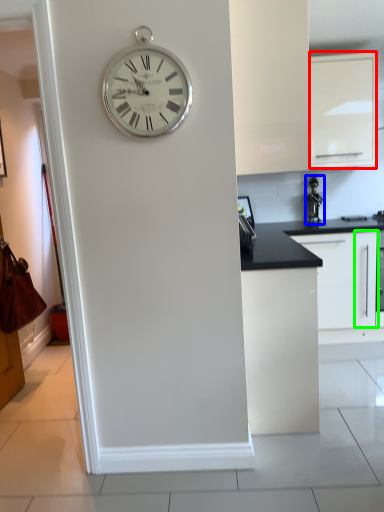
Question: Which is nearer to the cabinetry (highlighted by a red box)? appliance (highlighted by a blue box) or cabinetry (highlighted by a green box).

Choices:
 (A) appliance
 (B) cabinetry

Answer: (A)